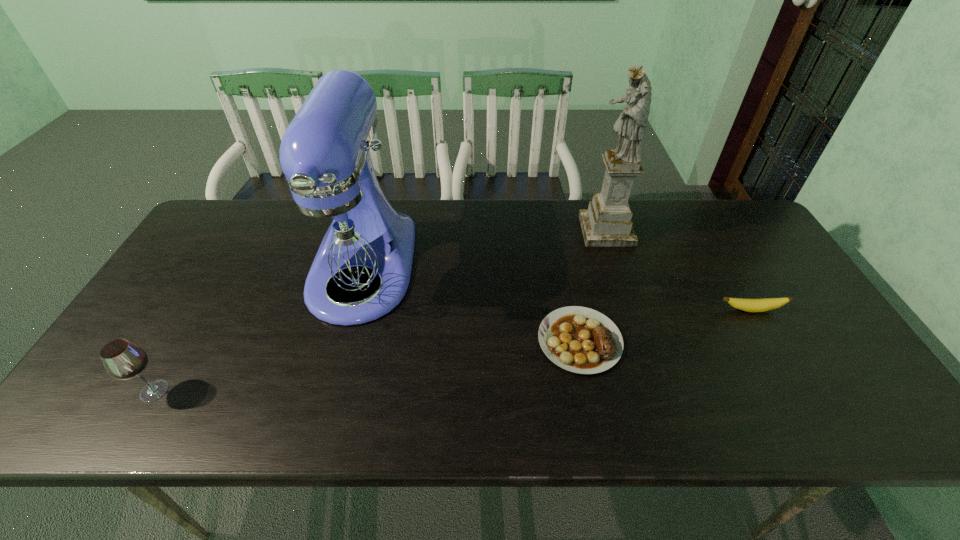
At what (x,y) coordinates should I click in order to perform the action: click on sculpture. Please return your answer as a coordinate pair (x, y). This screenshot has width=960, height=540. Looking at the image, I should click on (607, 222).

The image size is (960, 540). Find the location of `mixer`. mixer is located at coordinates (339, 234).

You are a GUI agent. You are given a task and a screenshot of the screen. Output one action in this format:
    pyautogui.click(x=<x>, y=<y>)
    Task: Click on the leftmost object
    
    Given the screenshot: What is the action you would take?
    tap(122, 359)

You are a GUI agent. You are given a task and a screenshot of the screen. Output one action in this format:
    pyautogui.click(x=<x>, y=<y>)
    Task: Click on the wineglass
    The height and width of the screenshot is (540, 960).
    Given the screenshot: What is the action you would take?
    pyautogui.click(x=122, y=359)

What are the coordinates of `banana` in the screenshot? It's located at (750, 305).

Find the location of `the second shortest object`. the second shortest object is located at coordinates (x=750, y=305).

At what (x,y) coordinates should I click in order to perform the action: click on steak. Please return your answer as a coordinate pair (x, y). Looking at the image, I should click on (578, 339).

Find the location of `free space located 0.110m on the front-facing side of the sculpture`. free space located 0.110m on the front-facing side of the sculpture is located at coordinates (547, 231).

You are a GUI agent. You are given a task and a screenshot of the screen. Output one action in this format:
    pyautogui.click(x=<x>, y=<y>)
    Task: Click on the free spot located 0.100m on the front-facing side of the sculpture
    
    Given the screenshot: What is the action you would take?
    pyautogui.click(x=550, y=231)

Locate an element on the screen. vacant space located 0.150m on the front-facing side of the sculpture is located at coordinates (534, 231).